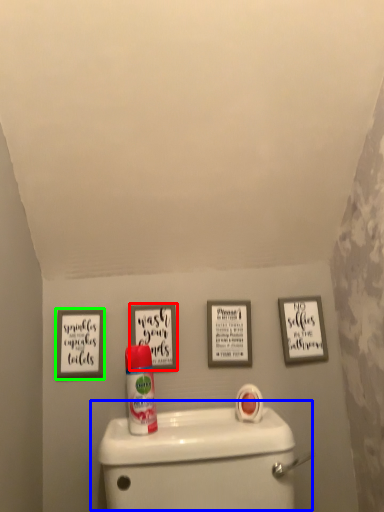
Question: Which is farther away from picture frame (highlighted by a red box)? toilet (highlighted by a blue box) or picture frame (highlighted by a green box)?

Choices:
 (A) toilet
 (B) picture frame

Answer: (A)